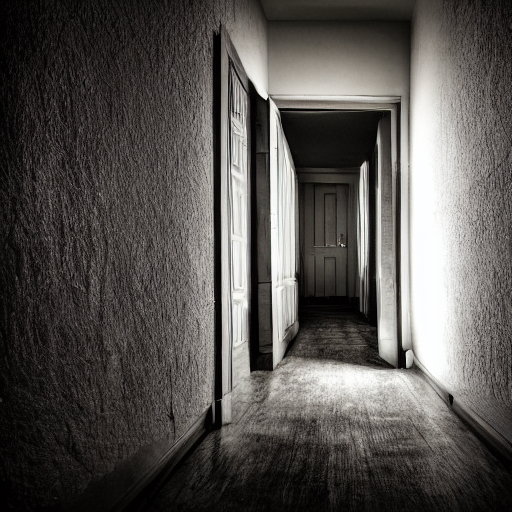
Image resolution: width=512 pixels, height=512 pixels. I want to click on wall, so click(333, 30).